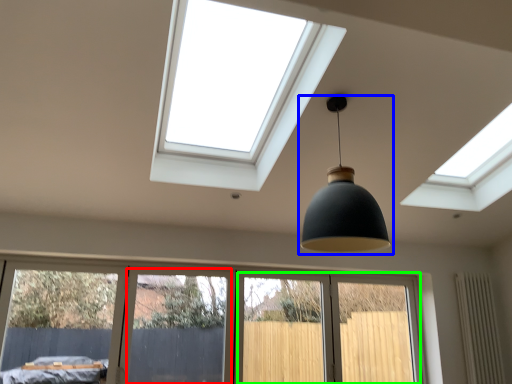
Question: Based on their relative distances, which object is nearer to screen door (highlighted by a red box)? Choose from lamp (highlighted by a blue box) and screen door (highlighted by a green box).

Choices:
 (A) lamp
 (B) screen door

Answer: (B)